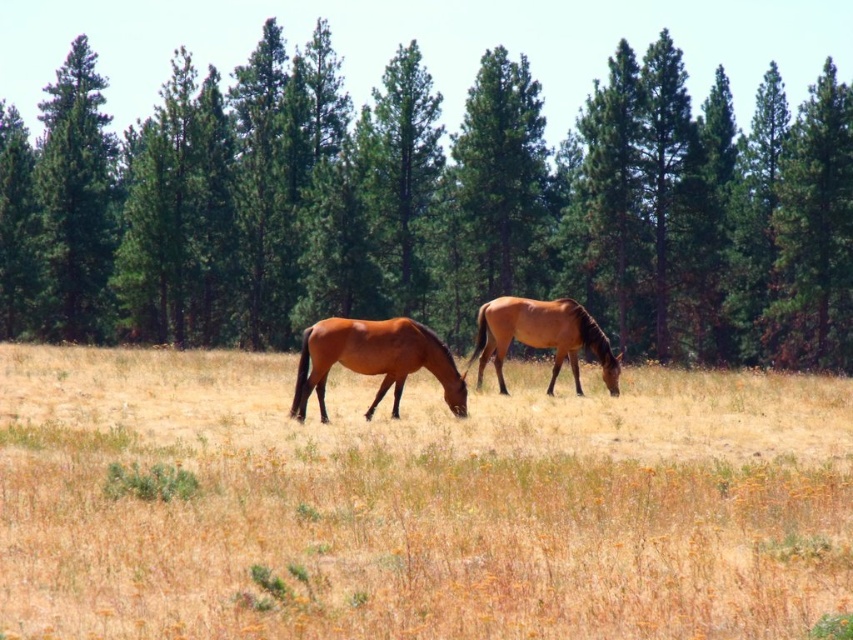
In the scene shown: Does green leafy trees at center come in front of shiny brown horse at center?

No, green leafy trees at center is further to the viewer.

Is green leafy trees at center further to camera compared to shiny brown horse at center?

That is True.

The height and width of the screenshot is (640, 853). I want to click on green leafy trees at center, so click(x=431, y=205).

Does green leafy trees at center have a greater height compared to brown grass at center?

Yes, green leafy trees at center is taller than brown grass at center.

Is point (189, 106) positioned behind point (608, 410)?

Yes.

Does point (680, 193) come farther from viewer compared to point (289, 467)?

Yes, it is.

Where is `green leafy trees at center`? The height and width of the screenshot is (640, 853). green leafy trees at center is located at coordinates (431, 205).

Does green leafy trees at center appear over brown glossy horse at center?

Indeed, green leafy trees at center is positioned over brown glossy horse at center.

Can you confirm if green leafy trees at center is wider than brown glossy horse at center?

Yes, green leafy trees at center is wider than brown glossy horse at center.

Between point (91, 296) and point (517, 339), which one is positioned behind?

Point (91, 296)

You are a GUI agent. You are given a task and a screenshot of the screen. Output one action in this format:
    pyautogui.click(x=<x>, y=<y>)
    Task: Click on the green leafy trees at center
    
    Given the screenshot: What is the action you would take?
    (x=431, y=205)